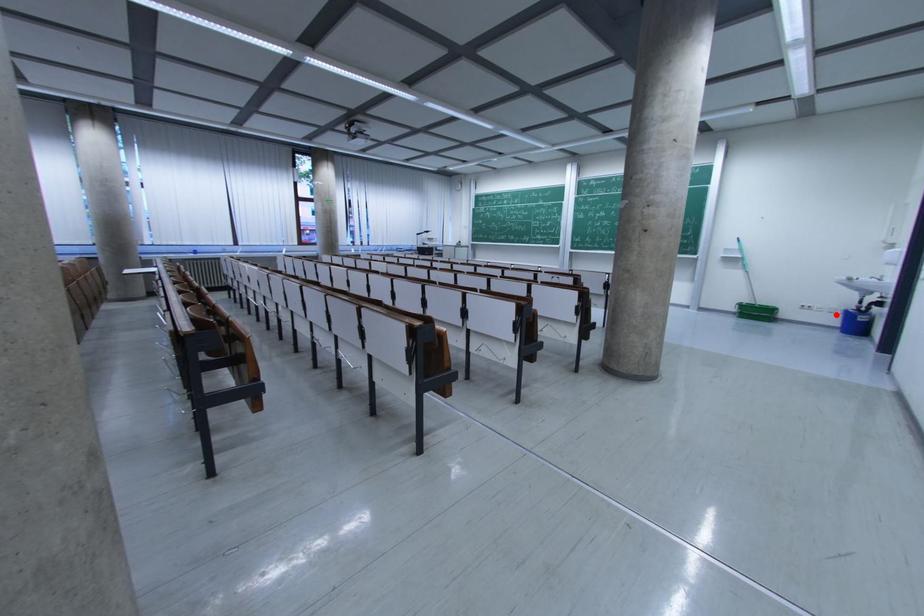
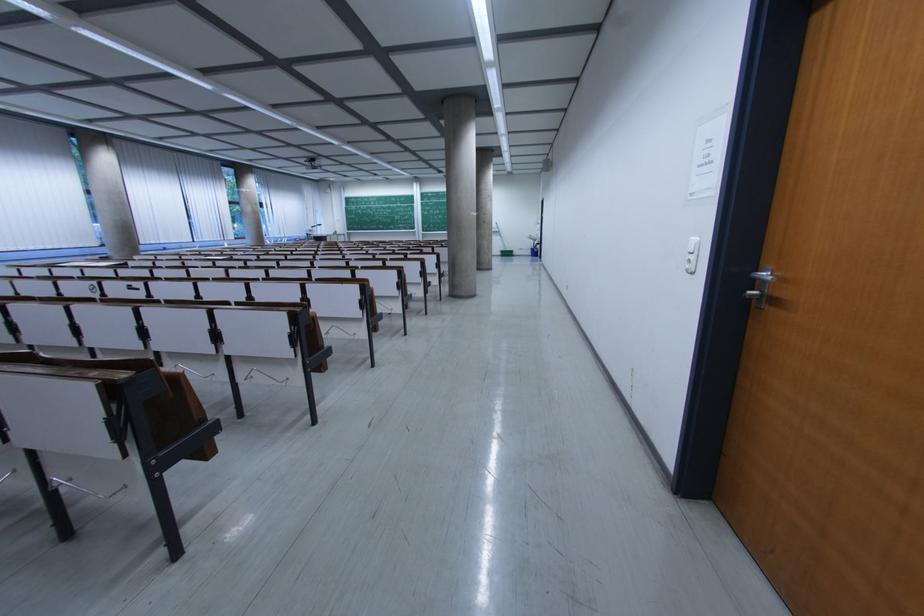
In the second image, find the point that corresponds to the highlighted location in the first image.

(532, 253)